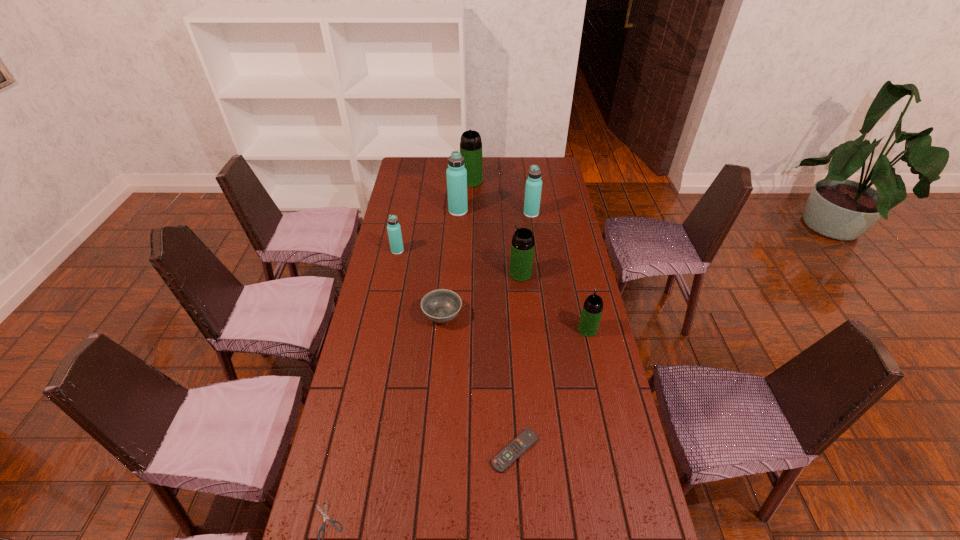
In the image, there is a desktop. At what (x,y) coordinates should I click in order to perform the action: click on vacant space at the right edge. Please return your answer as a coordinate pair (x, y). This screenshot has height=540, width=960. Looking at the image, I should click on (564, 290).

In the image, there is a desktop. Where is `vacant space at the far left corner`? The height and width of the screenshot is (540, 960). vacant space at the far left corner is located at coordinates (410, 179).

You are a GUI agent. You are given a task and a screenshot of the screen. Output one action in this format:
    pyautogui.click(x=<x>, y=<y>)
    Task: Click on the free area in between the gray bowl and the nearest green thermos bottle
    The image size is (960, 540).
    Given the screenshot: What is the action you would take?
    pyautogui.click(x=515, y=322)

Find the location of `vacant area that lies between the remote control and the second nearest thermos bottle`. vacant area that lies between the remote control and the second nearest thermos bottle is located at coordinates (517, 362).

Image resolution: width=960 pixels, height=540 pixels. In order to click on blank region between the third nearest thermos bottle and the remote control in this screenshot , I will do `click(456, 351)`.

Identify the location of unoccupied area between the biggest aqua thermos bottle and the second biggest aqua thermos bottle. This screenshot has height=540, width=960. (494, 213).

Find the location of a particular element. The image size is (960, 540). unoccupied area between the biggest aqua thermos bottle and the leftmost thermos bottle is located at coordinates click(x=428, y=231).

You are a GUI agent. You are given a task and a screenshot of the screen. Output one action in this format:
    pyautogui.click(x=<x>, y=<y>)
    Task: Click on the object that is the third nearest to the smallest aqua thermos bottle
    The width and height of the screenshot is (960, 540).
    Given the screenshot: What is the action you would take?
    pyautogui.click(x=522, y=247)

Select which object is the second closest to the rightmost object. Please provide its 2D coordinates. Your answer should be formatted as a tuple, i.e. [(x, y)], where the tuple contains the x and y coordinates of a point satisfying the conditions above.

[(508, 455)]

Find the location of a particular element. This screenshot has height=540, width=960. thermos bottle object that ranks as the fourth closest to the second farthest green thermos bottle is located at coordinates (394, 231).